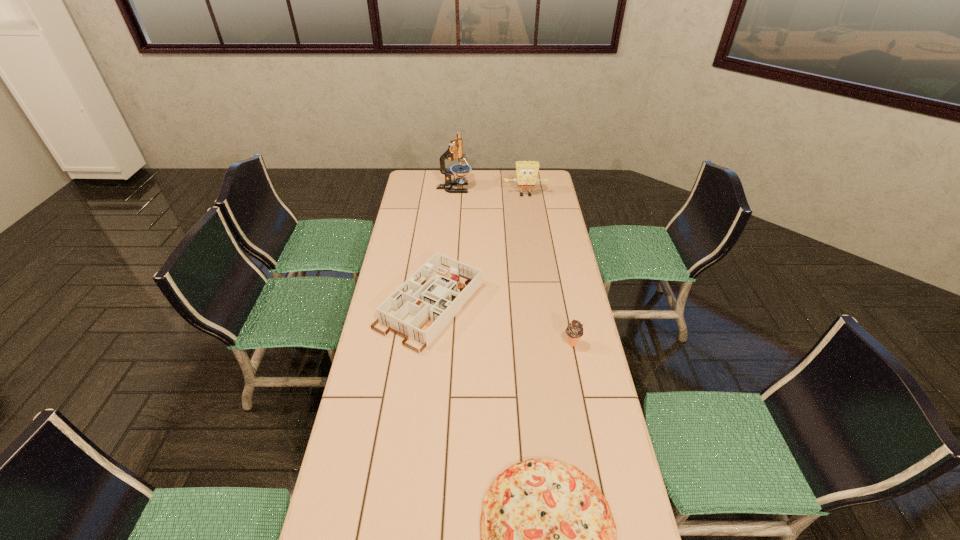
Identify the location of object located in the left edge section of the desktop. (426, 302).

You are a GUI agent. You are given a task and a screenshot of the screen. Output one action in this format:
    pyautogui.click(x=<x>, y=<y>)
    Task: Click on the sponge that is at the right edge
    Image resolution: width=960 pixels, height=540 pixels.
    Given the screenshot: What is the action you would take?
    pyautogui.click(x=527, y=171)

Where is `icecream that is at the right edge`? icecream that is at the right edge is located at coordinates (574, 330).

You are a GUI agent. You are given a task and a screenshot of the screen. Output one action in this format:
    pyautogui.click(x=<x>, y=<y>)
    Task: Click on the object at the far right corner
    
    Given the screenshot: What is the action you would take?
    pyautogui.click(x=527, y=171)

Where is `free space at the far edge of the desktop`? free space at the far edge of the desktop is located at coordinates (492, 192).

The height and width of the screenshot is (540, 960). In the image, there is a desktop. Identify the location of free space at the left edge. (417, 205).

This screenshot has width=960, height=540. Find the location of `vacant space at the right edge of the desktop`. vacant space at the right edge of the desktop is located at coordinates (554, 210).

Locate an element on the screen. Image resolution: width=960 pixels, height=540 pixels. vacant space at the far left corner of the desktop is located at coordinates (420, 189).

Find the location of a particular element. This screenshot has height=540, width=960. free point between the tallest object and the second shortest object is located at coordinates (442, 247).

This screenshot has height=540, width=960. What are the coordinates of `vacant region between the microscope and the third shortest object` in the screenshot? It's located at 513,266.